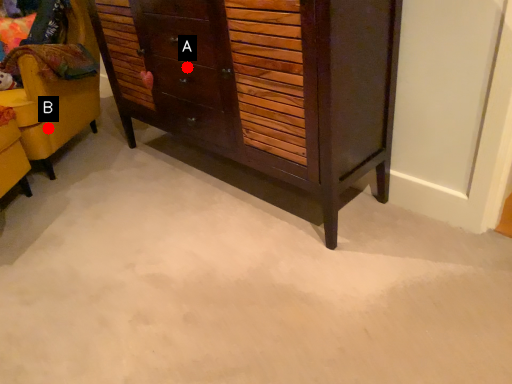
Question: Two points are circled on the image, labeled by A and B beside each circle. Which point is further to the camera?

Choices:
 (A) A is further
 (B) B is further

Answer: (B)